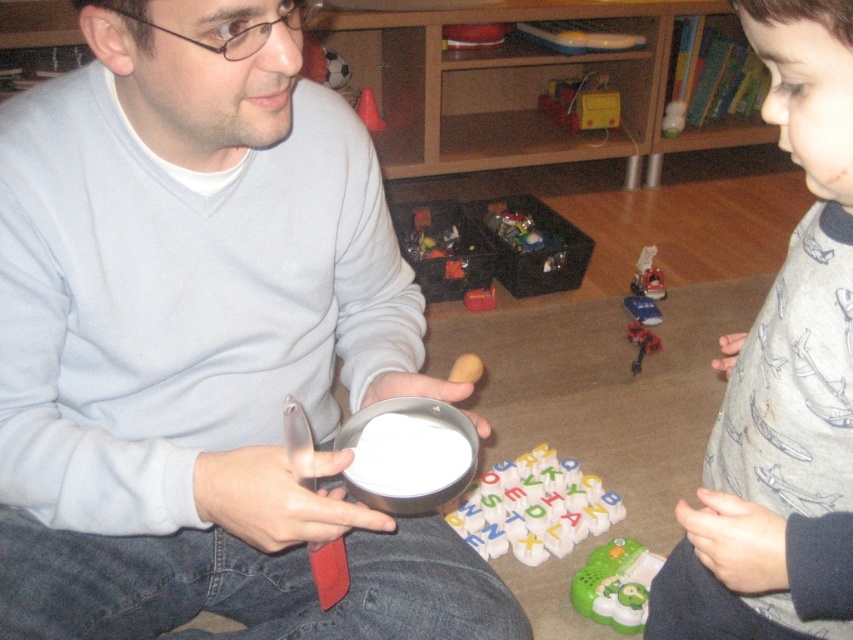
You are a parent trying to decide whether to place a small snack on the table between the gray cotton pajamas at right and the metallic red toy car at center. Based on their positions, which object is closer to the table?

The gray cotton pajamas at right is closer to the viewer than the metallic red toy car at center, so the snack should be placed near the gray cotton pajamas at right to be closer to the table.

You are a delivery robot that needs to navigate through a narrow passage between the gray cotton pajamas at right and the metallic plastic toy car at center. The passage is 0.8 meters wide. Can you fit through?

The gray cotton pajamas at right might be wider than the metallic plastic toy car at center. Since the passage is 0.8 meters wide, and the pajamas could be wider than the toy car, it is uncertain if the total width of both objects combined would allow the robot to pass. However, if the pajamas are wider but positioned such that the combined width does not exceed 0.8 meters, then it might be possible. Without exact measurements, it is difficult to determine for sure.

You are a delivery robot that needs to place a package between the gray cotton pajamas at right and the metallic red toy car at center. The package requires 1 meter of space. Is there enough space?

The gray cotton pajamas at right and metallic red toy car at center are 1.22 meters apart from each other. Since the required space is 1 meter, there is enough space to place the package between them.